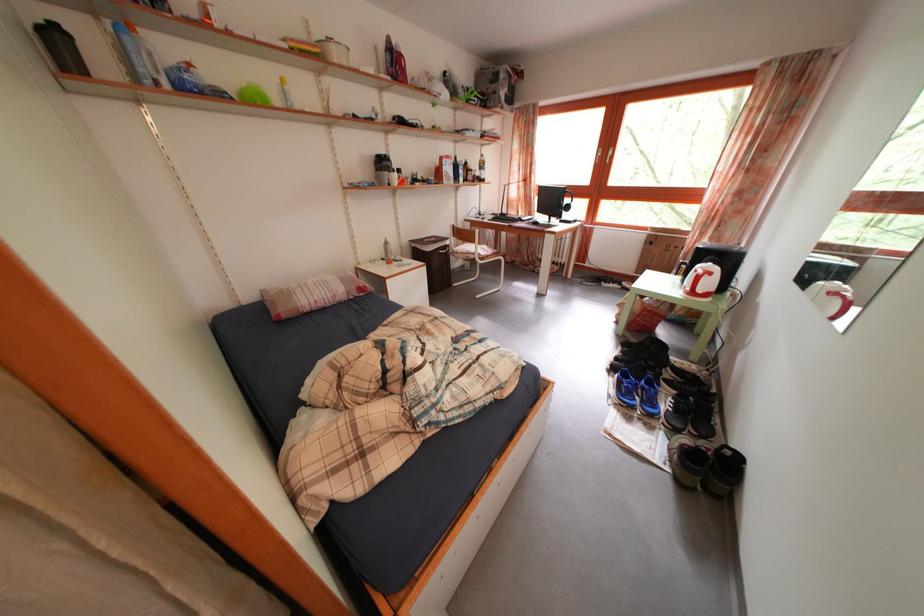
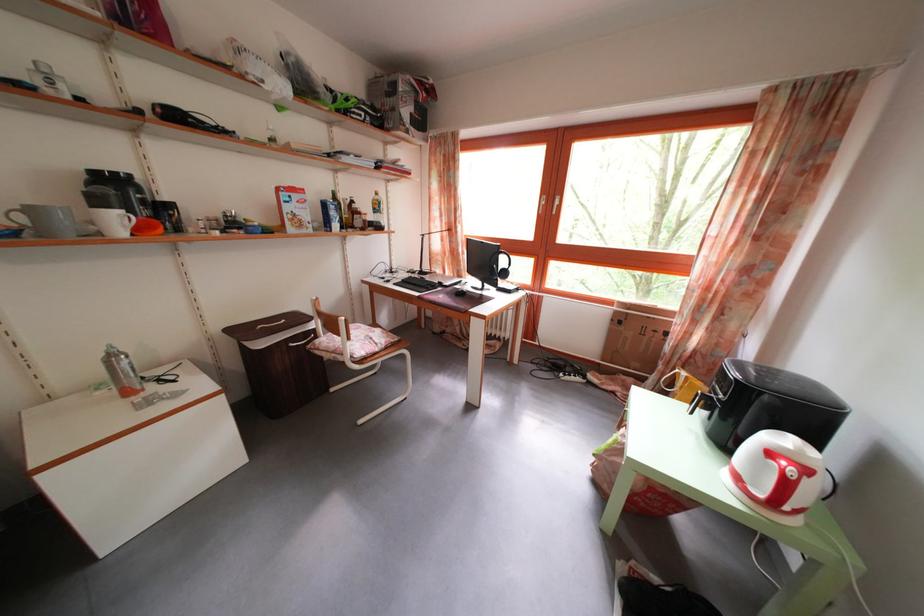
In the second image, find the point that corresponds to point (394, 251) in the first image.

(118, 363)